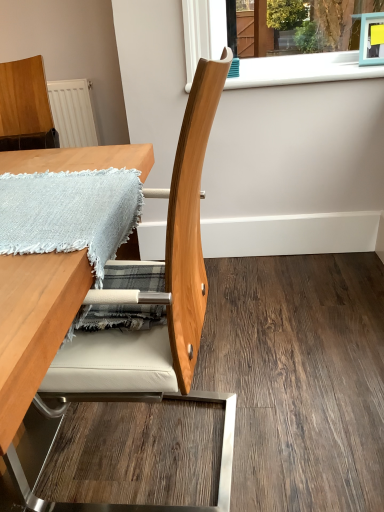
Question: Relative to wooden table at center, is wooden chair at center in front or behind?

Choices:
 (A) front
 (B) behind

Answer: (B)

Question: From a real-world perspective, is wooden chair at center above or below wooden table at center?

Choices:
 (A) below
 (B) above

Answer: (B)

Question: Estimate the real-world distances between objects in this image. Which object is closer to the light blue woven blanket at upper left?

Choices:
 (A) white plastic window sill at upper center
 (B) wooden chair at center
 (C) wooden table at center
 (D) natural wood chair at center

Answer: (B)

Question: Which object is positioned closest to the wooden table at center?

Choices:
 (A) natural wood chair at center
 (B) white plastic window sill at upper center
 (C) wooden chair at center
 (D) light blue woven blanket at upper left

Answer: (D)